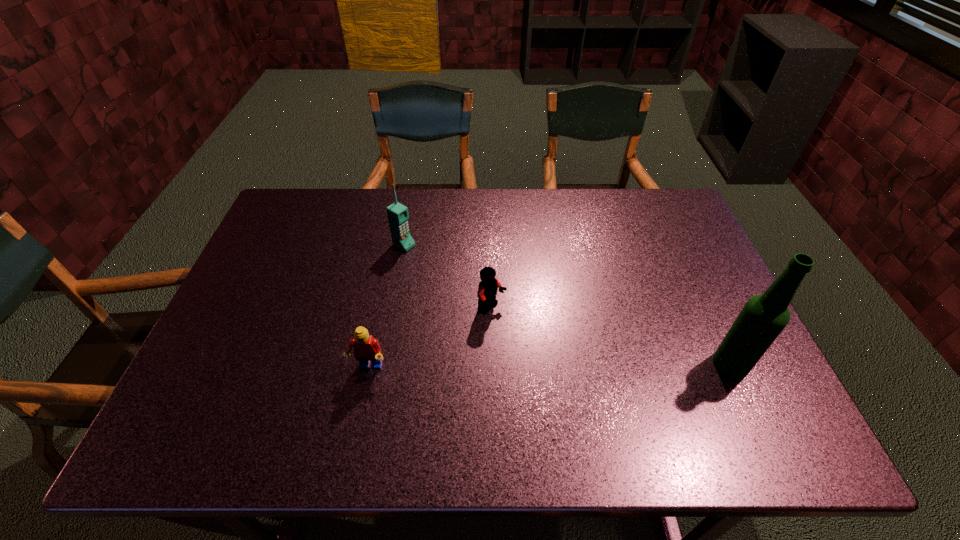
Locate an element on the screen. Image resolution: width=960 pixels, height=540 pixels. vacant point at the left edge is located at coordinates (278, 234).

Where is `blank space at the far left corner of the desktop`? The image size is (960, 540). blank space at the far left corner of the desktop is located at coordinates (301, 212).

The image size is (960, 540). In the image, there is a desktop. Find the location of `vacant region at the far right corner`. vacant region at the far right corner is located at coordinates (640, 228).

The height and width of the screenshot is (540, 960). Find the location of `empty space between the rightmost object and the left Lego`. empty space between the rightmost object and the left Lego is located at coordinates (549, 366).

Identify the location of empty space that is in between the farther Lego and the nearer Lego. The width and height of the screenshot is (960, 540). (430, 339).

Find the location of a particular element. This screenshot has width=960, height=540. free space between the cellular telephone and the left Lego is located at coordinates (386, 306).

Find the location of a particular element. The image size is (960, 540). vacant area that lies between the left Lego and the farthest object is located at coordinates (386, 306).

This screenshot has width=960, height=540. Find the location of `free spot between the second tallest object and the third object from left to right`. free spot between the second tallest object and the third object from left to right is located at coordinates (448, 277).

Locate an element on the screen. This screenshot has height=540, width=960. free space that is in between the tallest object and the farther Lego is located at coordinates (612, 336).

Image resolution: width=960 pixels, height=540 pixels. I want to click on vacant area between the beer bottle and the second tallest object, so click(x=567, y=305).